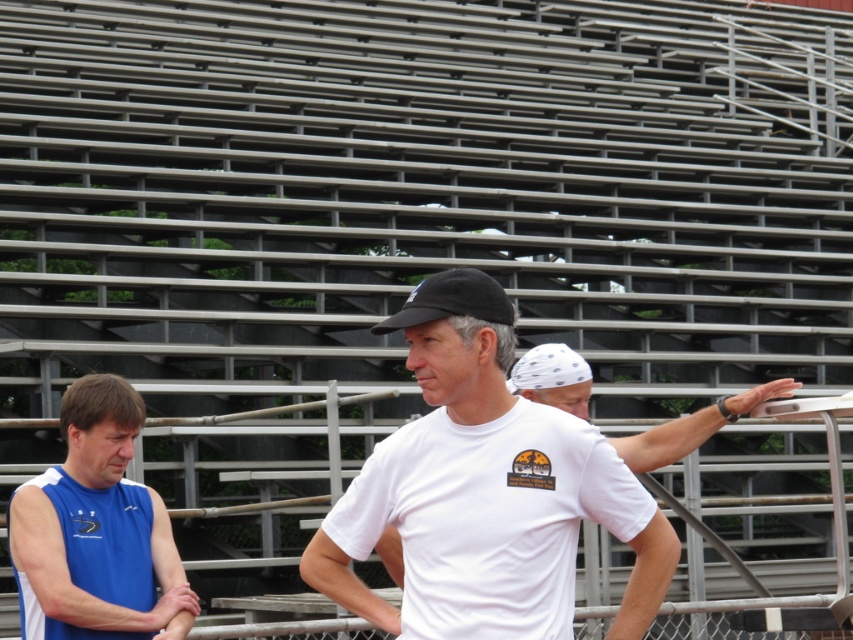
Looking at this image, is white matte t-shirt at center below blue sleeveless shirt at left?

No.

Is point (434, 570) farther from viewer compared to point (126, 561)?

No.

What do you see at coordinates (485, 490) in the screenshot? I see `white matte t-shirt at center` at bounding box center [485, 490].

The height and width of the screenshot is (640, 853). I want to click on white matte t-shirt at center, so click(485, 490).

Image resolution: width=853 pixels, height=640 pixels. Identify the location of white matte t-shirt at center. (485, 490).

How much distance is there between blue sleeveless shirt at left and black matte baseball cap at center?

The distance of blue sleeveless shirt at left from black matte baseball cap at center is 2.33 meters.

Consider the image. Which is above, blue sleeveless shirt at left or black matte baseball cap at center?

black matte baseball cap at center is higher up.

Which is behind, point (32, 529) or point (434, 288)?

Positioned behind is point (32, 529).

This screenshot has width=853, height=640. What are the coordinates of `blue sleeveless shirt at left` in the screenshot? It's located at (96, 531).